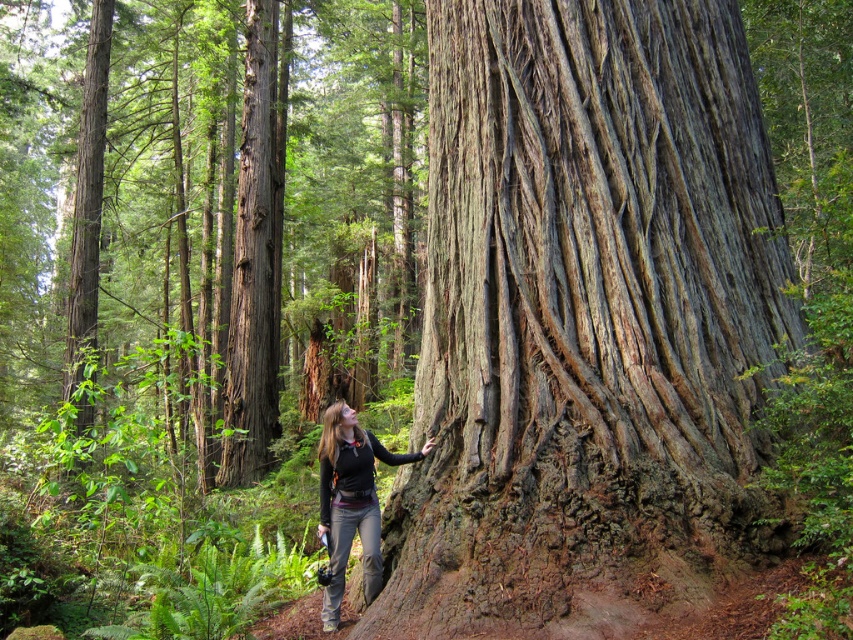
Question: From the image, what is the correct spatial relationship of smooth brown bark at center in relation to matte black jacket at center?

Choices:
 (A) left
 (B) right

Answer: (A)

Question: In this image, where is rough bark tree trunk at center located relative to matte black jacket at center?

Choices:
 (A) right
 (B) left

Answer: (A)

Question: Which is nearer to the matte black jacket at center?

Choices:
 (A) rough bark tree trunk at center
 (B) smooth brown bark at center

Answer: (A)

Question: Is the position of smooth brown bark at center more distant than that of matte black jacket at center?

Choices:
 (A) yes
 (B) no

Answer: (A)

Question: Which of the following is the farthest from the observer?

Choices:
 (A) rough bark tree trunk at center
 (B) matte black jacket at center
 (C) smooth brown bark at center

Answer: (C)

Question: Estimate the real-world distances between objects in this image. Which object is closer to the rough bark tree trunk at center?

Choices:
 (A) matte black jacket at center
 (B) smooth brown bark at center

Answer: (A)